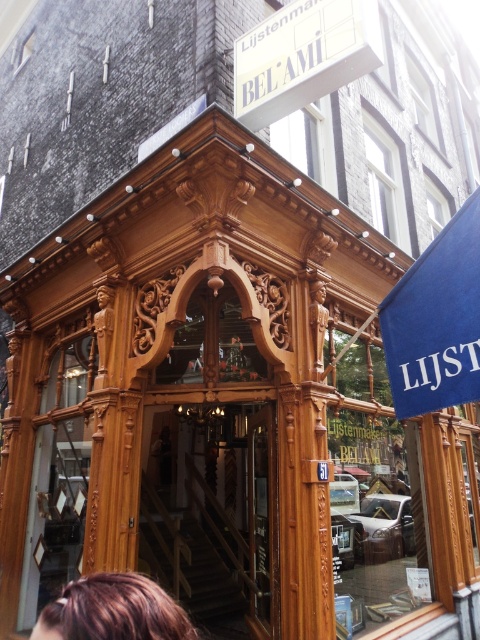
You are a GUI agent. You are given a task and a screenshot of the screen. Output one action in this format:
    pyautogui.click(x=<x>, y=<y>)
    Task: Click on the wooden stairs at center
    This screenshot has width=480, height=640.
    Given the screenshot: What is the action you would take?
    (211, 509)

Can you confirm if wooden stairs at center is wider than white plastic sign at upper center?

Yes.

Is point (204, 449) positioned after point (254, 38)?

Yes, point (204, 449) is behind point (254, 38).

Find the location of a particular element. This screenshot has height=640, width=480. wooden stairs at center is located at coordinates (211, 509).

Can you confirm if white plastic sign at upper center is thinner than brown hair at lower left?

Incorrect, white plastic sign at upper center's width is not less than brown hair at lower left's.

Does white plastic sign at upper center have a greater width compared to brown hair at lower left?

Yes, white plastic sign at upper center is wider than brown hair at lower left.

Locate an element on the screen. white plastic sign at upper center is located at coordinates (302, 56).

I want to click on white plastic sign at upper center, so click(x=302, y=56).

Who is lower down, wooden stairs at center or brown hair at lower left?

Positioned lower is wooden stairs at center.

Is wooden stairs at center further to camera compared to brown hair at lower left?

Yes, wooden stairs at center is behind brown hair at lower left.

Which is behind, point (275, 502) or point (50, 625)?

The point (275, 502) is behind.

Where is `wooden stairs at center`? The height and width of the screenshot is (640, 480). wooden stairs at center is located at coordinates (211, 509).